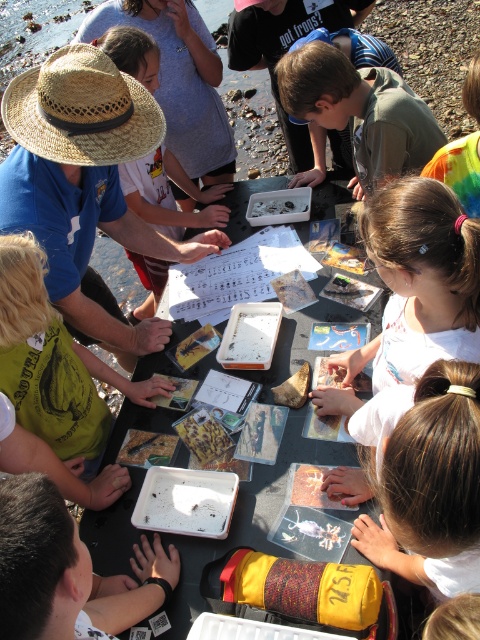
Question: Is straw hat at upper left above golden crispy chips at center?

Choices:
 (A) no
 (B) yes

Answer: (B)

Question: Which of these objects is positioned closest to the matte plastic food at center?

Choices:
 (A) black plastic table at center
 (B) straw hat at upper left

Answer: (A)

Question: Among these points, which one is nearest to the camera?

Choices:
 (A) (24, 556)
 (B) (261, 202)

Answer: (A)

Question: Is green cotton shirt at upper center positioned before golden crispy chips at center?

Choices:
 (A) no
 (B) yes

Answer: (A)

Question: Considering the real-world distances, which object is closest to the smooth plastic tray at center?

Choices:
 (A) green cotton shirt at upper center
 (B) golden crispy chips at center

Answer: (B)

Question: Is black plastic table at center below smooth plastic tray at center?

Choices:
 (A) yes
 (B) no

Answer: (B)